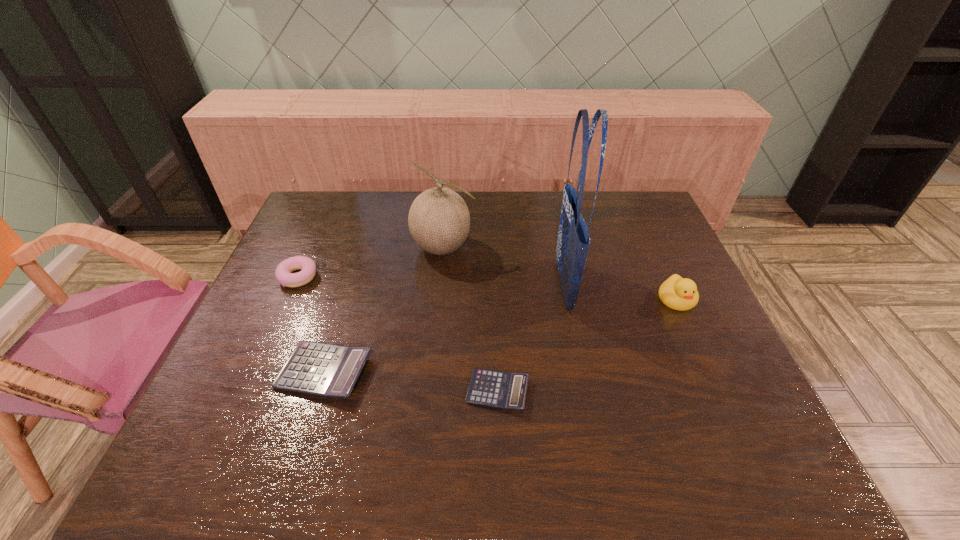
Considering the uniform spacing of calculators, where should an additional calculator be positioned on the right? Please locate a free spot. Please provide its 2D coordinates. Your answer should be formatted as a tuple, i.e. [(x, y)], where the tuple contains the x and y coordinates of a point satisfying the conditions above.

[(684, 412)]